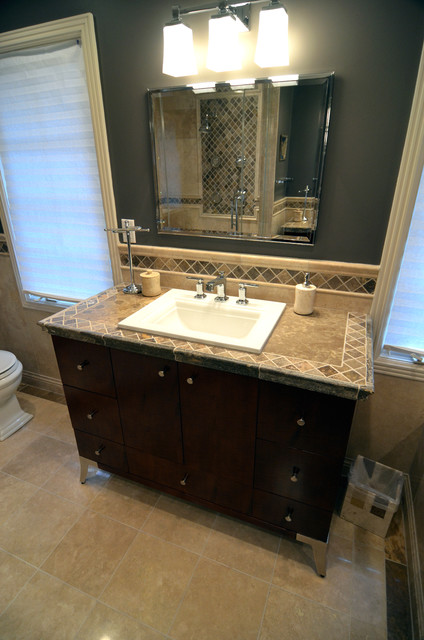
The width and height of the screenshot is (424, 640). I want to click on mirror, so click(x=221, y=189).